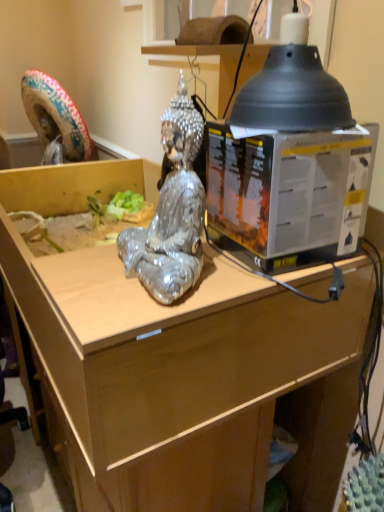
Question: From a real-world perspective, is wooden desk at center on metallic plastic box at center?

Choices:
 (A) no
 (B) yes

Answer: (A)

Question: Is wooden desk at center positioned with its back to metallic plastic box at center?

Choices:
 (A) no
 (B) yes

Answer: (A)

Question: Does wooden desk at center have a lesser height compared to metallic plastic box at center?

Choices:
 (A) yes
 (B) no

Answer: (B)

Question: From a real-world perspective, is wooden desk at center under metallic plastic box at center?

Choices:
 (A) no
 (B) yes

Answer: (B)

Question: Is wooden desk at center with metallic plastic box at center?

Choices:
 (A) no
 (B) yes

Answer: (A)

Question: In terms of size, does metallic plastic box at center appear bigger or smaller than wooden desk at center?

Choices:
 (A) small
 (B) big

Answer: (A)

Question: From a real-world perspective, is metallic plastic box at center physically located above or below wooden desk at center?

Choices:
 (A) above
 (B) below

Answer: (A)

Question: From the image's perspective, is metallic plastic box at center located above or below wooden desk at center?

Choices:
 (A) above
 (B) below

Answer: (A)

Question: Would you say metallic plastic box at center is inside or outside wooden desk at center?

Choices:
 (A) outside
 (B) inside

Answer: (A)

Question: Visually, is wooden desk at center positioned to the left or to the right of shiny metallic statue at center?

Choices:
 (A) right
 (B) left

Answer: (B)

Question: Considering the positions of wooden desk at center and shiny metallic statue at center in the image, is wooden desk at center taller or shorter than shiny metallic statue at center?

Choices:
 (A) short
 (B) tall

Answer: (A)

Question: Is wooden desk at center wider or thinner than shiny metallic statue at center?

Choices:
 (A) thin
 (B) wide

Answer: (B)

Question: Relative to shiny metallic statue at center, is wooden desk at center in front or behind?

Choices:
 (A) front
 (B) behind

Answer: (B)

Question: Considering the positions of point (135, 245) and point (258, 196), is point (135, 245) closer or farther from the camera than point (258, 196)?

Choices:
 (A) closer
 (B) farther

Answer: (B)

Question: Is shiny metallic statue at center spatially inside metallic plastic box at center, or outside of it?

Choices:
 (A) inside
 (B) outside

Answer: (B)